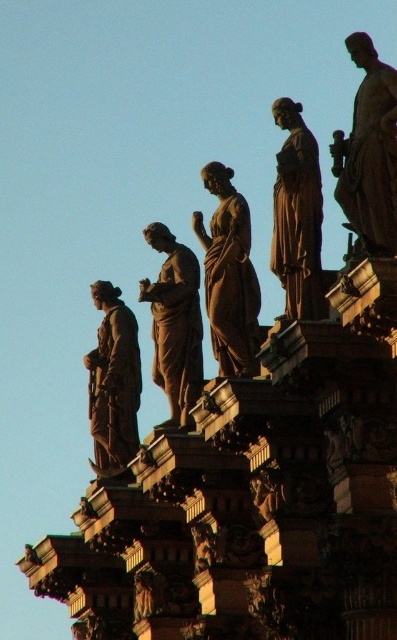
Question: Which object is farther from the camera taking this photo?

Choices:
 (A) bronze statue at center
 (B) matte bronze statue at center

Answer: (B)

Question: Does matte bronze statue at center have a greater width compared to brown polished statue at center?

Choices:
 (A) yes
 (B) no

Answer: (B)

Question: Which point appears farthest from the camera in this image?

Choices:
 (A) (279, 228)
 (B) (96, 404)
 (C) (240, 376)
 (D) (360, 211)

Answer: (B)

Question: Which point appears farthest from the camera in this image?

Choices:
 (A) (308, 250)
 (B) (379, 134)
 (C) (219, 230)

Answer: (C)

Question: Is matte bronze statue at center closer to camera compared to brown polished statue at center?

Choices:
 (A) yes
 (B) no

Answer: (A)

Question: Is brown polished statue at center wider than bronze statue at left?

Choices:
 (A) no
 (B) yes

Answer: (A)